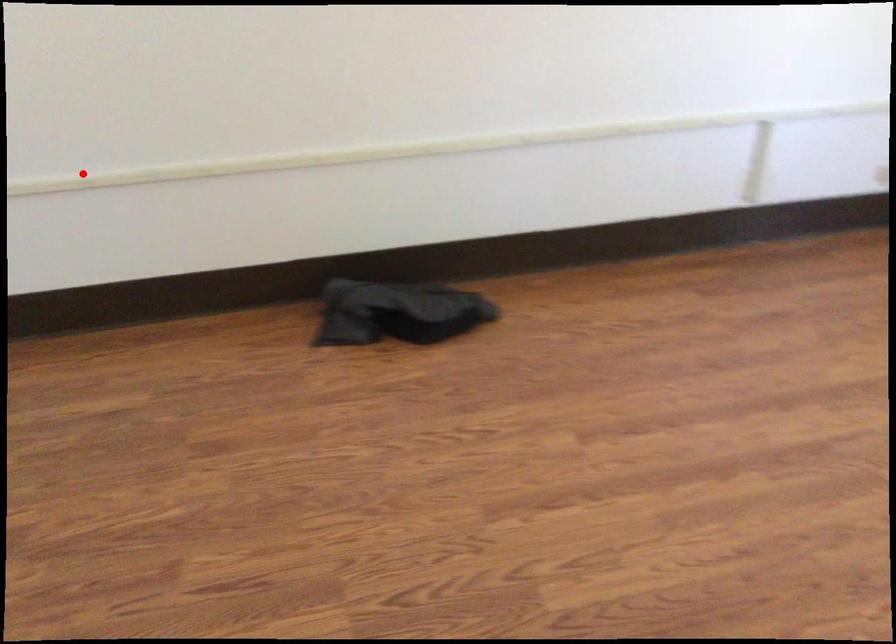
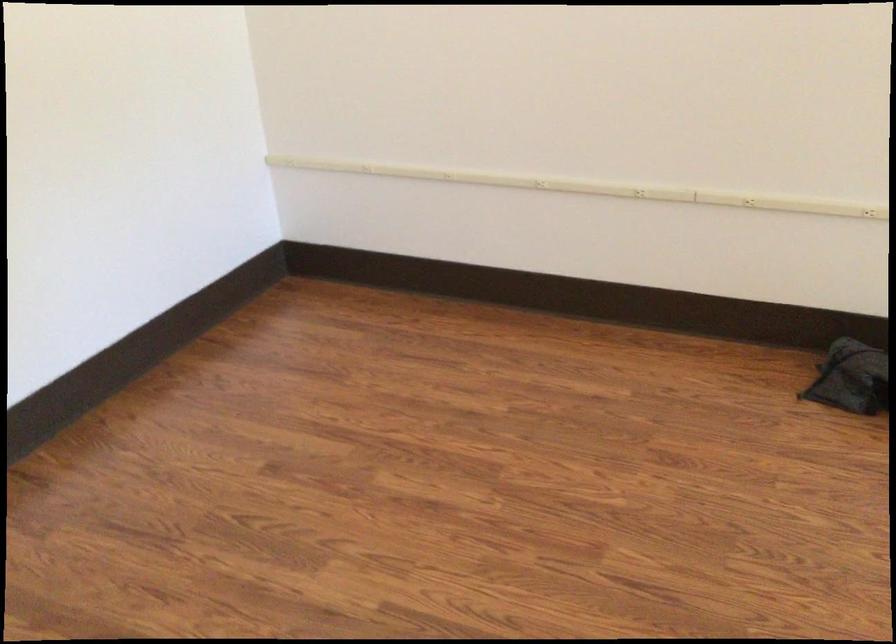
Question: I am providing you with two images of the same scene from different viewpoints. Given a red point in image1, look at the same physical point in image2. Is it:

Choices:
 (A) Closer to the viewpoint
 (B) Farther from the viewpoint

Answer: (B)